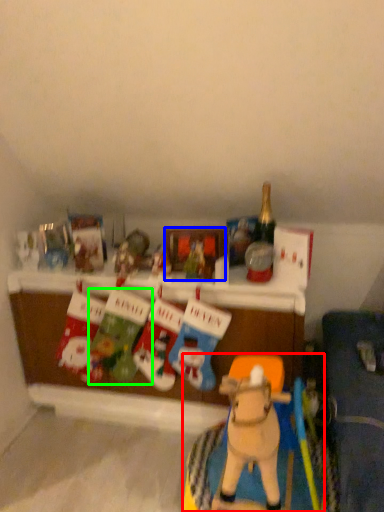
Question: Which is farther away from toy (highlighted by a red box)? picture frame (highlighted by a blue box) or toy (highlighted by a green box)?

Choices:
 (A) picture frame
 (B) toy

Answer: (A)